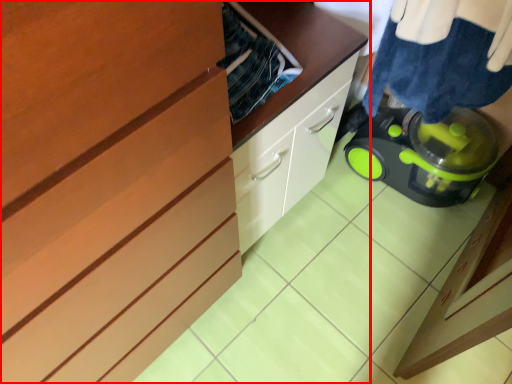
Question: Where is cabinetry (annotated by the red box) located in relation to laundry in the image?

Choices:
 (A) left
 (B) right

Answer: (A)